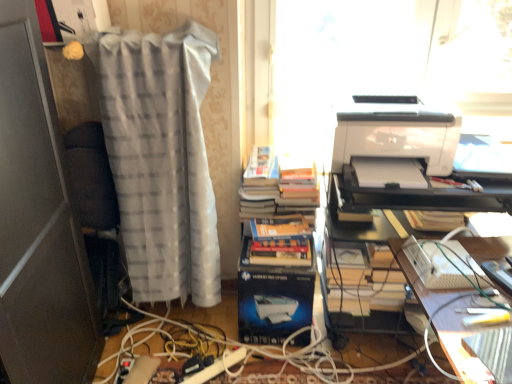
I want to click on free space that is in between dark brown leather file cabinet at left and blue glossy paperback book at center, so pos(185,344).